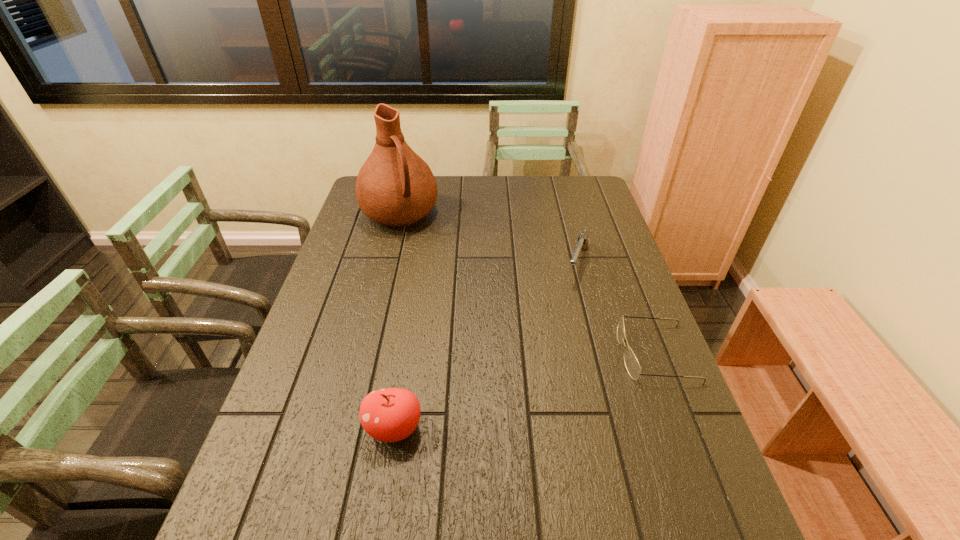
I want to click on free spot on the desktop that is between the nearest object and the third farthest object and is positioned on the side of the tallest object with the handle, so tap(509, 395).

Where is `vacant space on the desktop that is between the apple and the second nearest object and is positioned aiming along the barrel of the third object from left to right`? vacant space on the desktop that is between the apple and the second nearest object and is positioned aiming along the barrel of the third object from left to right is located at coordinates (530, 389).